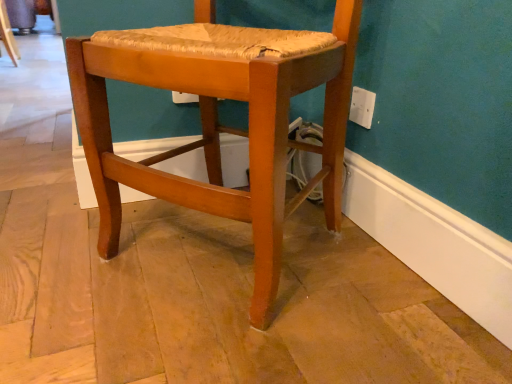
Question: From a real-world perspective, is white plastic electric outlet at upper right on top of matte wood chair at center?

Choices:
 (A) no
 (B) yes

Answer: (B)

Question: From the image's perspective, is white plastic electric outlet at upper right below matte wood chair at center?

Choices:
 (A) yes
 (B) no

Answer: (B)

Question: Could you tell me if white plastic electric outlet at upper right is facing matte wood chair at center?

Choices:
 (A) no
 (B) yes

Answer: (B)

Question: Considering the relative sizes of white plastic electric outlet at upper right and matte wood chair at center in the image provided, is white plastic electric outlet at upper right shorter than matte wood chair at center?

Choices:
 (A) yes
 (B) no

Answer: (A)

Question: Can you confirm if white plastic electric outlet at upper right is thinner than matte wood chair at center?

Choices:
 (A) no
 (B) yes

Answer: (B)

Question: From the image's perspective, is white plastic electric outlet at upper right on matte wood chair at center?

Choices:
 (A) no
 (B) yes

Answer: (B)

Question: Is matte wood chair at center taller than white plastic electric outlet at upper right?

Choices:
 (A) yes
 (B) no

Answer: (A)

Question: Considering the relative positions of matte wood chair at center and white plastic electric outlet at upper right in the image provided, is matte wood chair at center to the right of white plastic electric outlet at upper right from the viewer's perspective?

Choices:
 (A) yes
 (B) no

Answer: (B)

Question: Is matte wood chair at center positioned beyond the bounds of white plastic electric outlet at upper right?

Choices:
 (A) yes
 (B) no

Answer: (A)

Question: From the image's perspective, does matte wood chair at center appear higher than white plastic electric outlet at upper right?

Choices:
 (A) no
 (B) yes

Answer: (A)

Question: Is matte wood chair at center positioned with its back to white plastic electric outlet at upper right?

Choices:
 (A) yes
 (B) no

Answer: (A)

Question: From the image's perspective, does matte wood chair at center appear lower than white plastic electric outlet at upper right?

Choices:
 (A) yes
 (B) no

Answer: (A)

Question: Visually, is matte wood chair at center positioned to the left or to the right of white plastic electric outlet at upper right?

Choices:
 (A) right
 (B) left

Answer: (B)